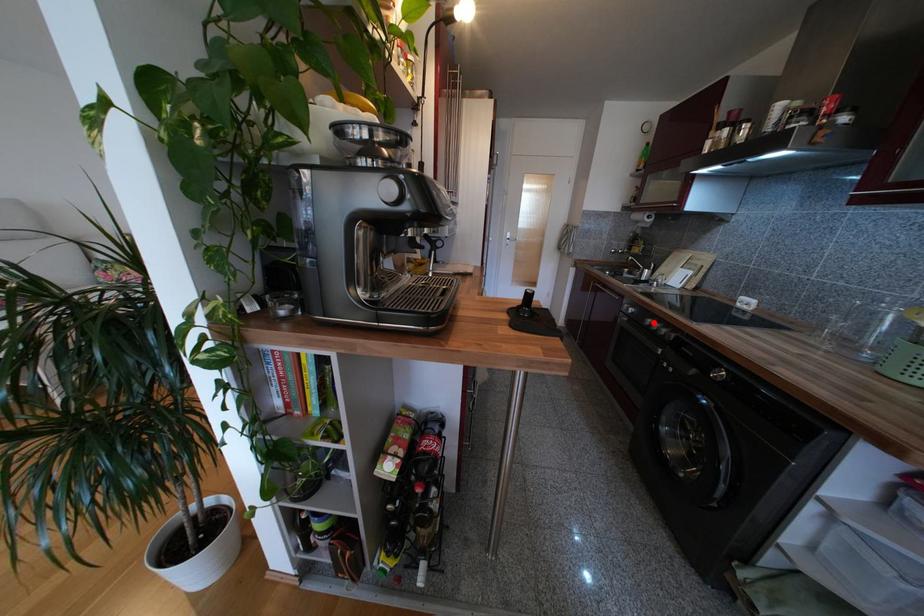
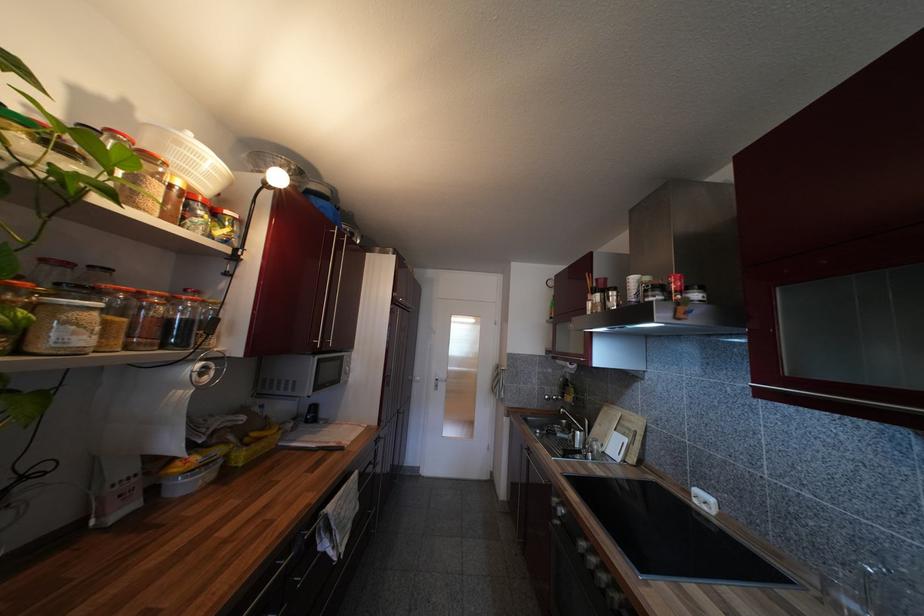
In the second image, find the point that corresponds to the highlighted location in the first image.

(587, 546)